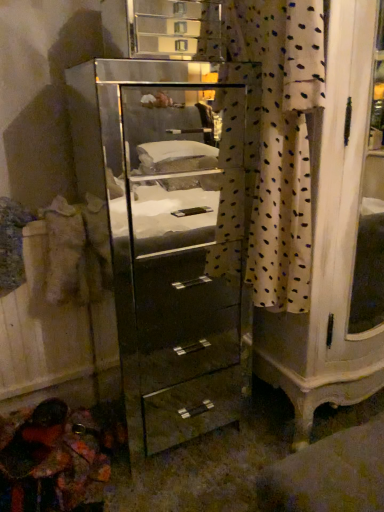
What are the coordinates of `vacant space in front of mirror-finished glass chest of drawers at center` in the screenshot? It's located at (196, 477).